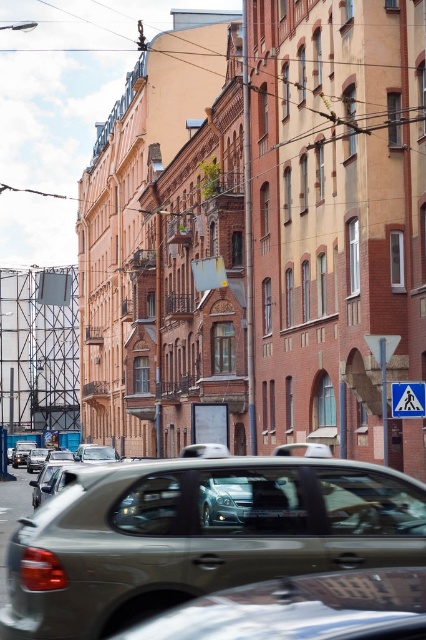
From the picture: Is metallic silver car at center further to the viewer compared to blue plastic pedestrian crossing sign at center?

No.

Which is in front, point (344, 548) or point (425, 397)?

Point (344, 548) is more forward.

Locate an element on the screen. metallic silver car at center is located at coordinates (199, 534).